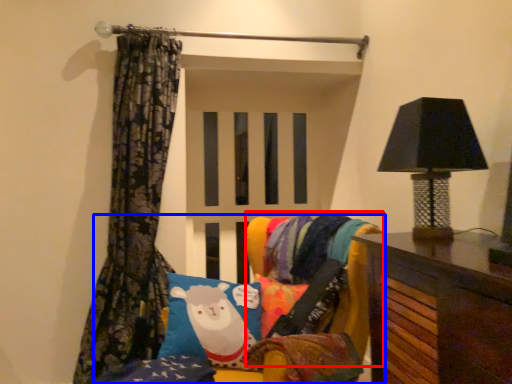
Question: Which point is further to the camera, bean bag chair (highlighted by a red box) or furniture (highlighted by a blue box)?

Choices:
 (A) bean bag chair
 (B) furniture

Answer: (A)